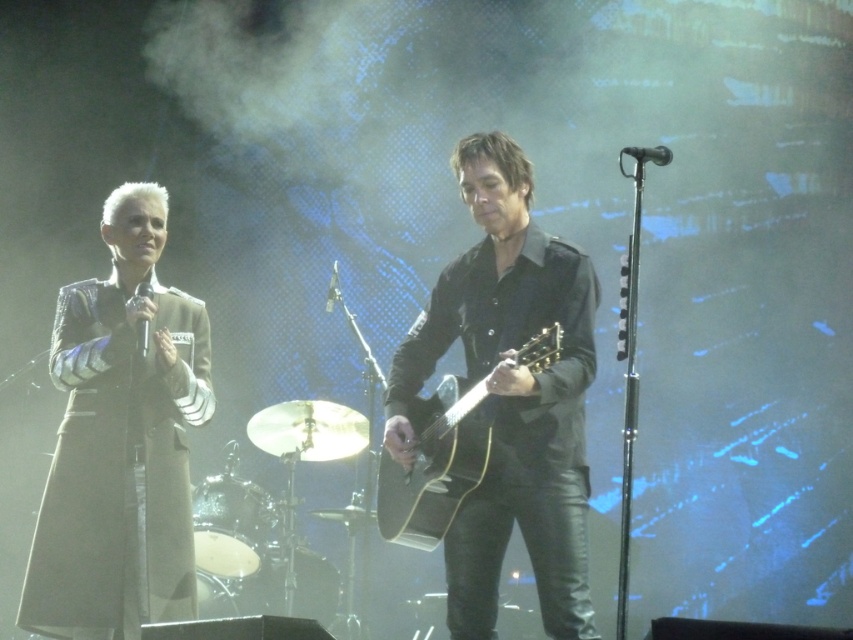
Does white drum at lower left appear under smooth black drum at lower center?

Actually, white drum at lower left is above smooth black drum at lower center.

Which of these two, white drum at lower left or smooth black drum at lower center, stands taller?

With more height is smooth black drum at lower center.

This screenshot has height=640, width=853. In order to click on white drum at lower left in this screenshot , I will do `click(229, 524)`.

Does leather jacket at center have a lesser width compared to smooth silver drum at lower left?

No, leather jacket at center is not thinner than smooth silver drum at lower left.

Is point (509, 412) farther from viewer compared to point (204, 572)?

No.

Find the location of a particular element. This screenshot has width=853, height=640. leather jacket at center is located at coordinates (509, 396).

Between leather jacket at center and matte black guitar at center, which one is positioned lower?

Positioned lower is matte black guitar at center.

Is leather jacket at center in front of matte black guitar at center?

That is False.

Is point (560, 440) behind point (425, 540)?

No, (560, 440) is closer to viewer.

At what (x,y) coordinates should I click in order to perform the action: click on leather jacket at center. Please return your answer as a coordinate pair (x, y). The width and height of the screenshot is (853, 640). Looking at the image, I should click on (509, 396).